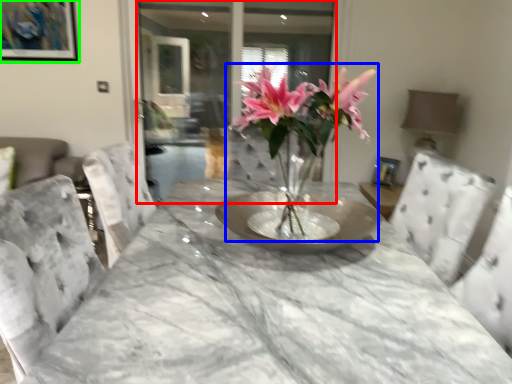
Question: Which object is positioned closest to glass door (highlighted by a red box)? Select from houseplant (highlighted by a blue box) and picture frame (highlighted by a green box).

Choices:
 (A) houseplant
 (B) picture frame

Answer: (B)